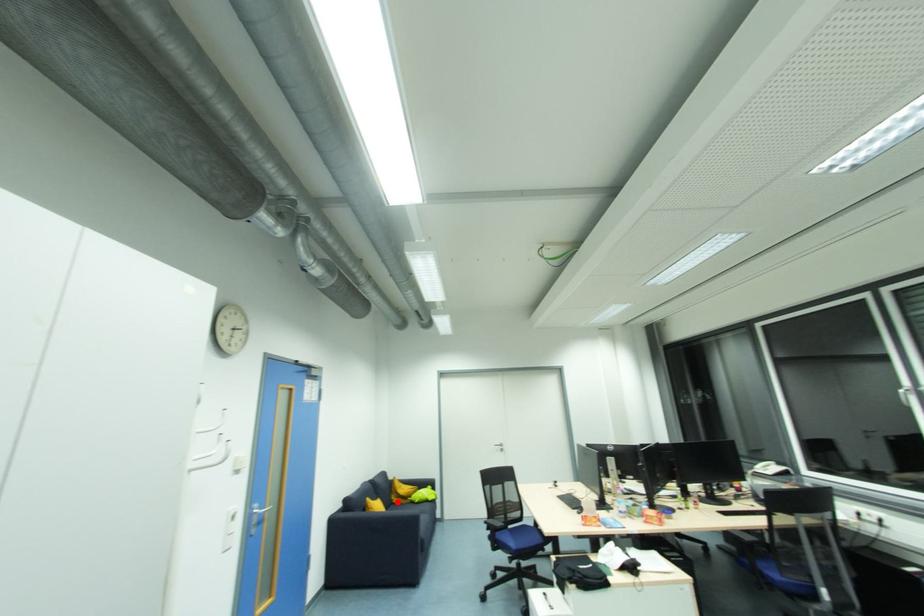
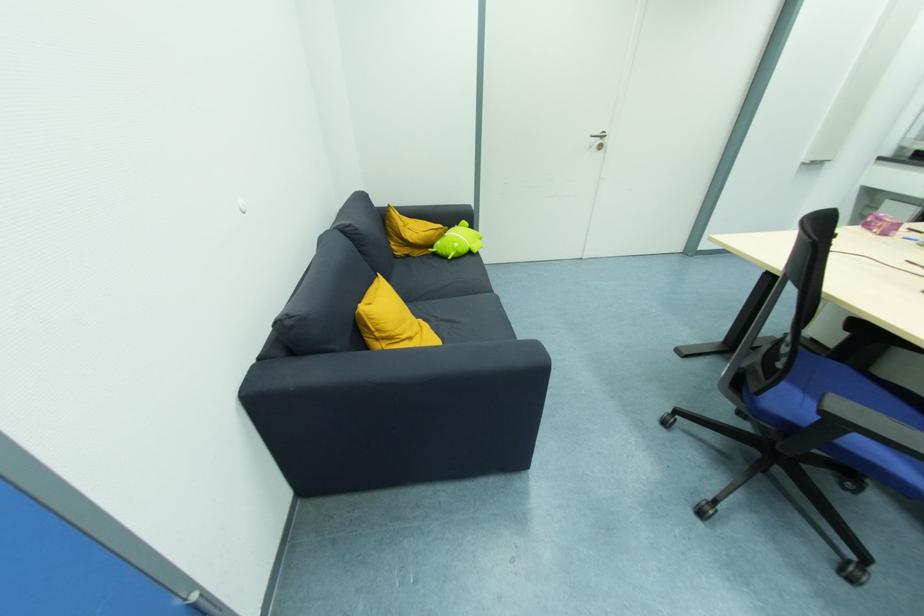
Locate, in the second image, the point that corresponds to the highlighted location in the first image.

(403, 253)